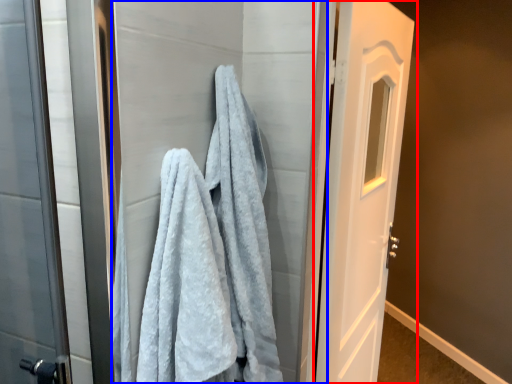
Question: Which of the following is the closest to the observer, door (highlighted by a red box) or screen door (highlighted by a blue box)?

Choices:
 (A) door
 (B) screen door

Answer: (B)